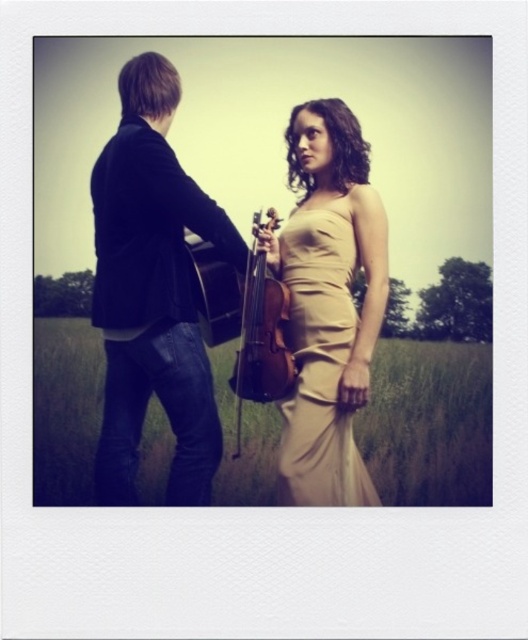
Question: Which of the following is the closest to the observer?

Choices:
 (A) beige silk dress at center
 (B) wooden violin at center
 (C) dark blue denim jeans at left
 (D) satin beige dress at center

Answer: (C)

Question: Is dark blue denim jeans at left below wooden violin at center?

Choices:
 (A) no
 (B) yes

Answer: (A)

Question: Observing the image, what is the correct spatial positioning of satin beige dress at center in reference to wooden violin at center?

Choices:
 (A) below
 (B) above

Answer: (A)

Question: Which point is closer to the camera taking this photo?

Choices:
 (A) (270, 321)
 (B) (212, 468)

Answer: (B)

Question: Is satin beige dress at center closer to camera compared to wooden violin at center?

Choices:
 (A) no
 (B) yes

Answer: (A)

Question: Which point appears closest to the camera in this image?

Choices:
 (A) (252, 442)
 (B) (185, 298)

Answer: (B)